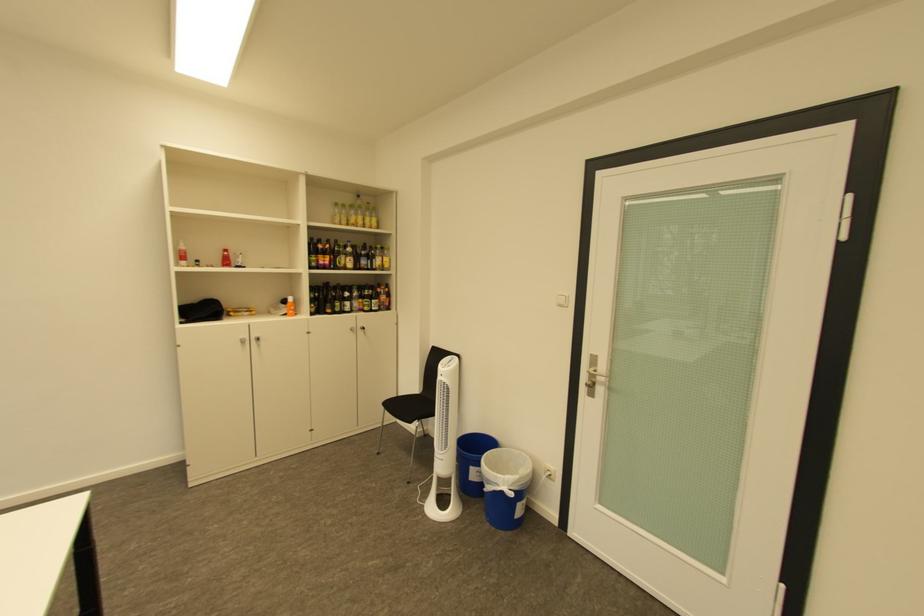
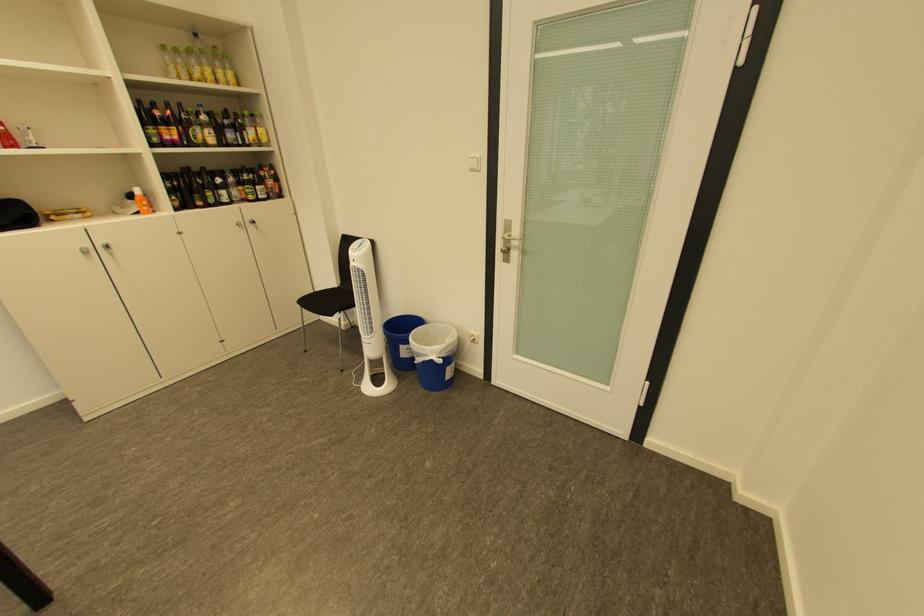
The point at (323, 259) is marked in the first image. Where is the corresponding point in the second image?

(162, 132)